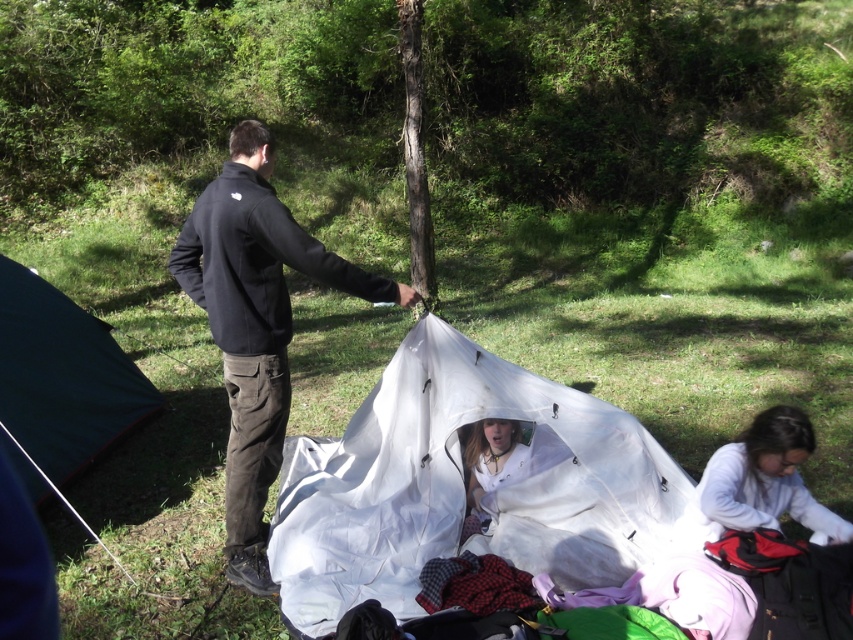
Is dark green tarp at left positioned before white matte jacket at lower right?

No, dark green tarp at left is further to the viewer.

Where is `dark green tarp at left`? Image resolution: width=853 pixels, height=640 pixels. dark green tarp at left is located at coordinates (61, 385).

Does point (70, 344) come behind point (809, 493)?

Yes, it is behind point (809, 493).

This screenshot has width=853, height=640. What are the coordinates of `dark green tarp at left` in the screenshot? It's located at (61, 385).

Can you confirm if white matte jacket at lower right is wider than brown rough bark tree at center?

Yes.

How much distance is there between white matte jacket at lower right and brown rough bark tree at center?

white matte jacket at lower right and brown rough bark tree at center are 6.36 meters apart from each other.

At what (x,y) coordinates should I click in order to perform the action: click on white matte jacket at lower right. Please return your answer as a coordinate pair (x, y). Looking at the image, I should click on click(758, 483).

Between black matte jacket at center and white matte jacket at lower right, which one is positioned higher?

black matte jacket at center is higher up.

Who is taller, black matte jacket at center or white matte jacket at lower right?

Standing taller between the two is black matte jacket at center.

Consider the image. Measure the distance between point (238, 477) and camera.

Point (238, 477) and camera are 4.01 meters apart.

The image size is (853, 640). What are the coordinates of `black matte jacket at center` in the screenshot? It's located at (254, 324).